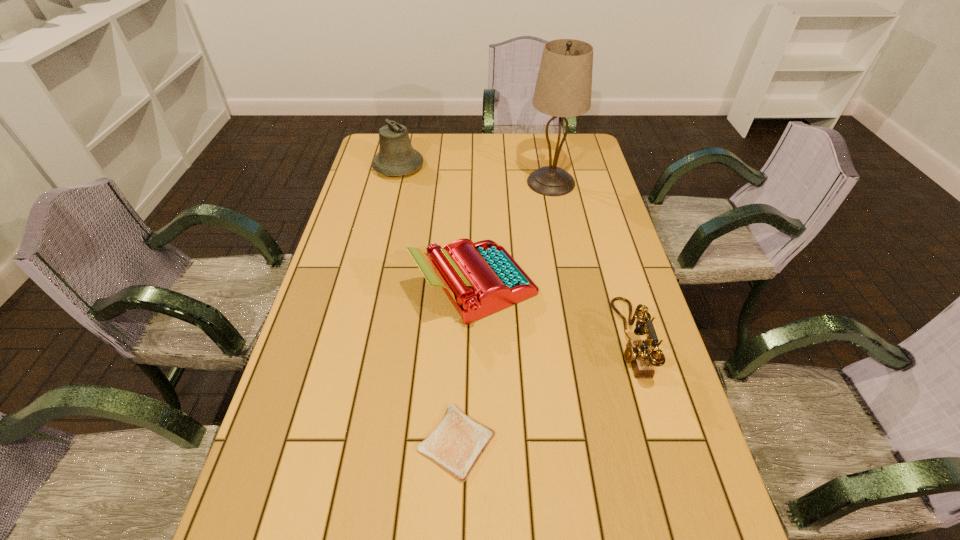
This screenshot has height=540, width=960. I want to click on lampshade, so click(x=563, y=89).

You are a GUI agent. You are given a task and a screenshot of the screen. Output one action in this format:
    pyautogui.click(x=<x>, y=<y>)
    Task: Click on the leftmost object
    
    Given the screenshot: What is the action you would take?
    pyautogui.click(x=396, y=157)

The image size is (960, 540). I want to click on the third tallest object, so click(481, 278).

Find the location of a particular element. telephone is located at coordinates (637, 353).

In order to click on toast in this screenshot , I will do `click(456, 444)`.

I want to click on the shortest object, so click(456, 444).

The width and height of the screenshot is (960, 540). I want to click on vacant space situated 0.110m on the front-facing side of the lampshade, so click(x=495, y=183).

At what (x,y) coordinates should I click in order to perform the action: click on free space located 0.070m on the front-facing side of the lampshade. Please return your answer as a coordinate pair (x, y). The width and height of the screenshot is (960, 540). Looking at the image, I should click on (506, 183).

At what (x,y) coordinates should I click in order to perform the action: click on free space located on the front-facing side of the lampshade. Please return your answer as a coordinate pair (x, y). Looking at the image, I should click on (509, 183).

The height and width of the screenshot is (540, 960). I want to click on vacant space located 0.360m on the front of the bell, so click(379, 248).